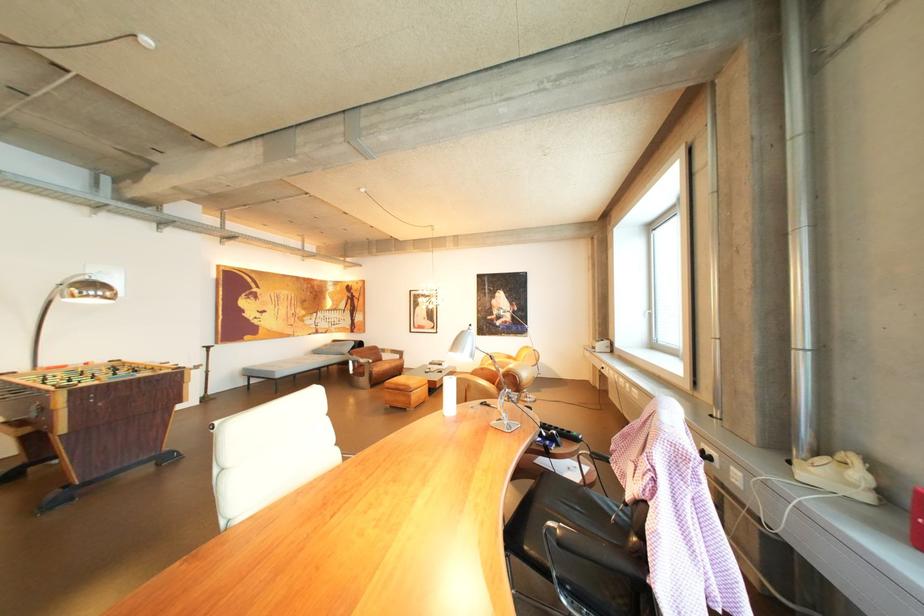
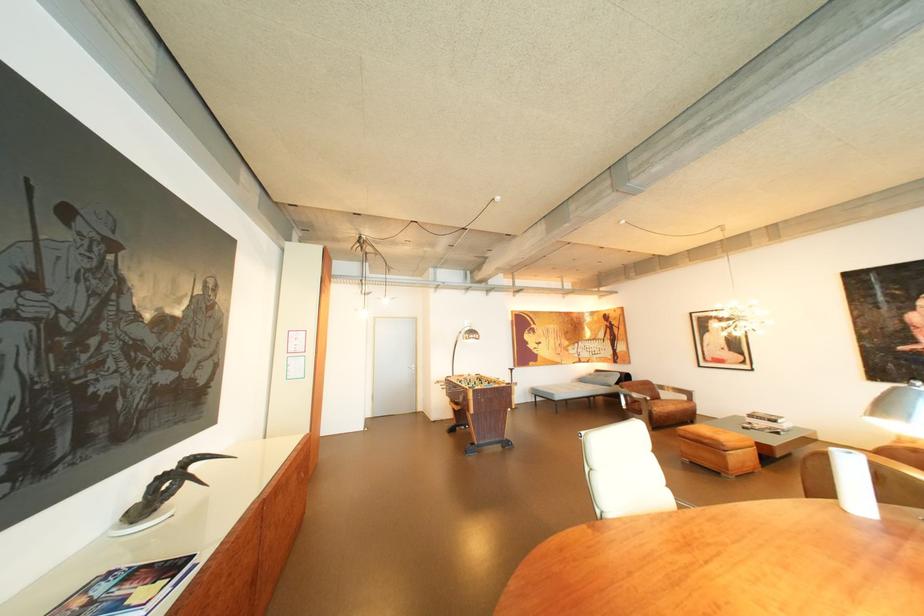
Find the pixel in the second image that matches point (469, 345) in the first image.

(896, 407)